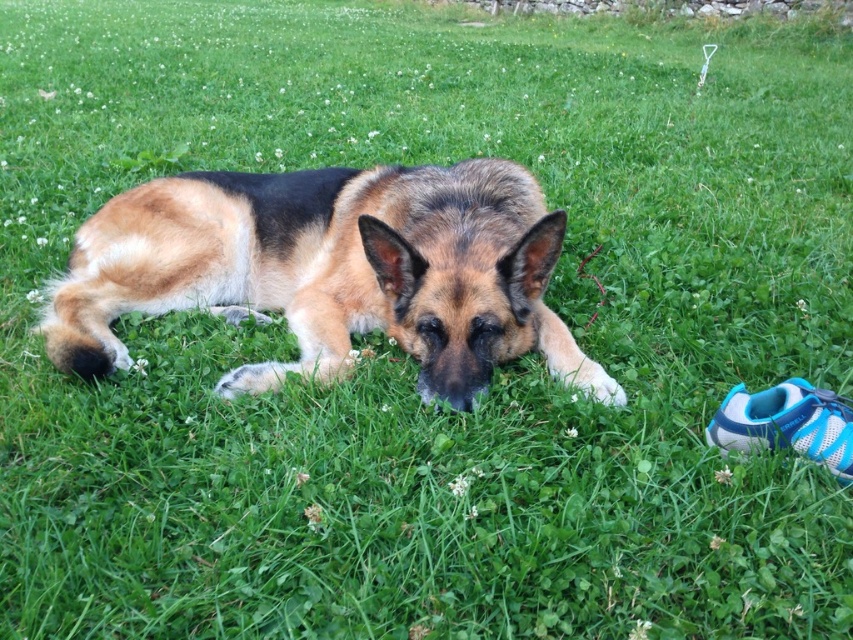
Question: Which point is closer to the camera?

Choices:
 (A) brown and black fur dog at center
 (B) blue mesh shoe at lower right

Answer: (B)

Question: Which point is closer to the camera?

Choices:
 (A) brown and black fur dog at center
 (B) blue mesh shoe at lower right

Answer: (B)

Question: Can you confirm if brown and black fur dog at center is wider than blue mesh shoe at lower right?

Choices:
 (A) yes
 (B) no

Answer: (A)

Question: Can you confirm if brown and black fur dog at center is wider than blue mesh shoe at lower right?

Choices:
 (A) no
 (B) yes

Answer: (B)

Question: Can you confirm if brown and black fur dog at center is positioned above blue mesh shoe at lower right?

Choices:
 (A) no
 (B) yes

Answer: (B)